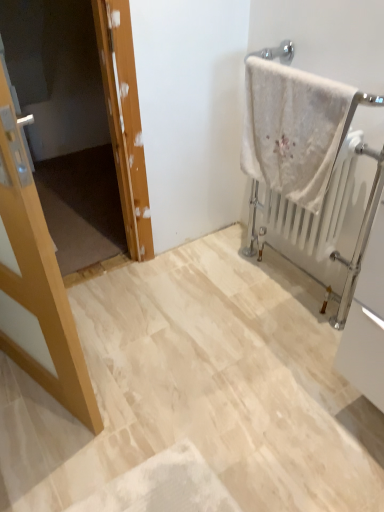
At what (x,y) coordinates should I click in order to perform the action: click on vacant space behind light wood door at left. Please return your answer as a coordinate pair (x, y). This screenshot has height=512, width=384. Looking at the image, I should click on [x=110, y=304].